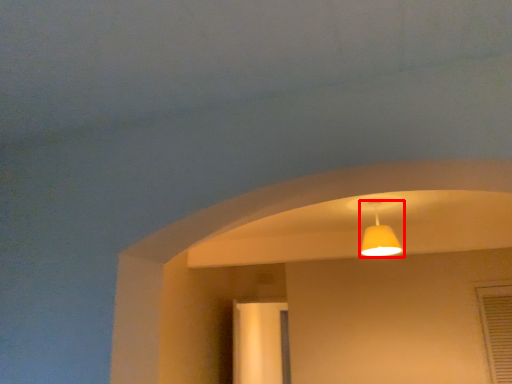
Question: Observing the image, what is the correct spatial positioning of lamp (annotated by the red box) in reference to screen door?

Choices:
 (A) right
 (B) left

Answer: (A)